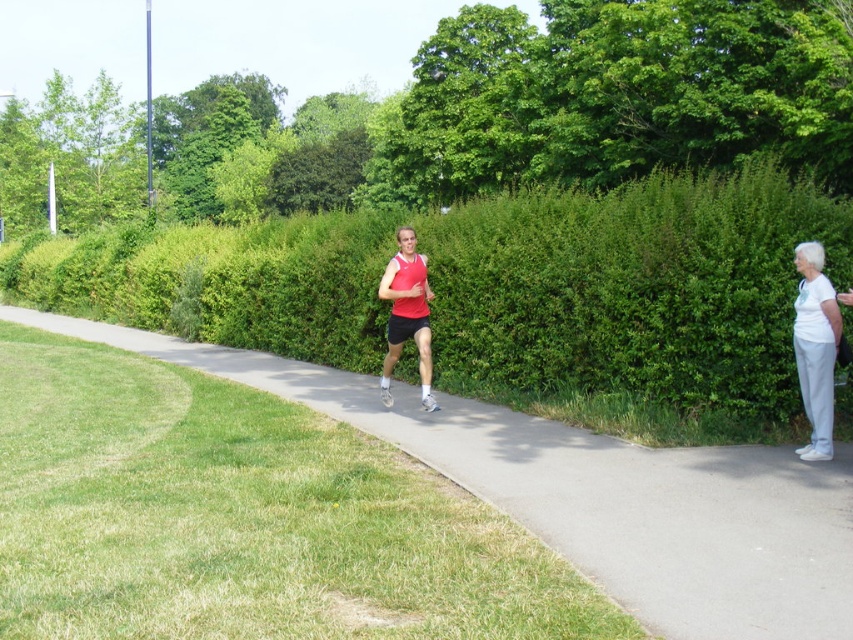
Between green leafy hedge at center and gray asphalt pavement at center, which one appears on the right side from the viewer's perspective?

gray asphalt pavement at center is more to the right.

What do you see at coordinates (498, 294) in the screenshot? The image size is (853, 640). I see `green leafy hedge at center` at bounding box center [498, 294].

The height and width of the screenshot is (640, 853). Describe the element at coordinates (498, 294) in the screenshot. I see `green leafy hedge at center` at that location.

At what (x,y) coordinates should I click in order to perform the action: click on green leafy hedge at center. Please return your answer as a coordinate pair (x, y). Looking at the image, I should click on (498, 294).

Does gray asphalt pavement at center have a lesser height compared to white matte pants at right?

Indeed, gray asphalt pavement at center has a lesser height compared to white matte pants at right.

Is gray asphalt pavement at center bigger than white matte pants at right?

Indeed, gray asphalt pavement at center has a larger size compared to white matte pants at right.

Is point (659, 634) closer to camera compared to point (805, 372)?

Yes, it is.

Where is `gray asphalt pavement at center`? This screenshot has width=853, height=640. gray asphalt pavement at center is located at coordinates [596, 496].

Measure the distance between gray asphalt pavement at center and matte red tank top at center.

gray asphalt pavement at center is 1.57 meters away from matte red tank top at center.

In the scene shown: How far apart are gray asphalt pavement at center and matte red tank top at center?

A distance of 5.15 feet exists between gray asphalt pavement at center and matte red tank top at center.

Is point (585, 467) behind point (421, 380)?

No, (585, 467) is in front of (421, 380).

Locate an element on the screen. Image resolution: width=853 pixels, height=640 pixels. gray asphalt pavement at center is located at coordinates (596, 496).